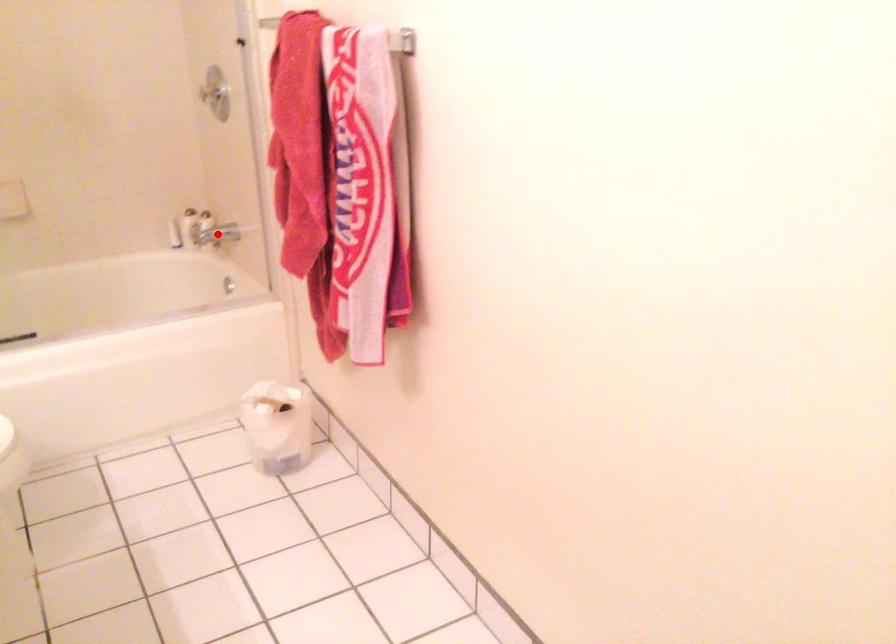
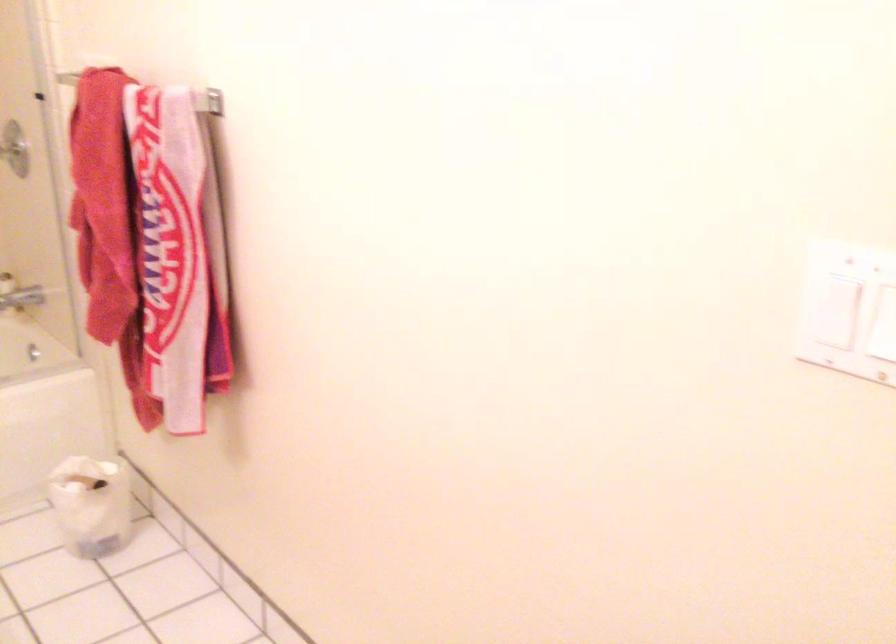
Where in the second image is the point corresponding to the highlighted location from the first image?

(20, 299)